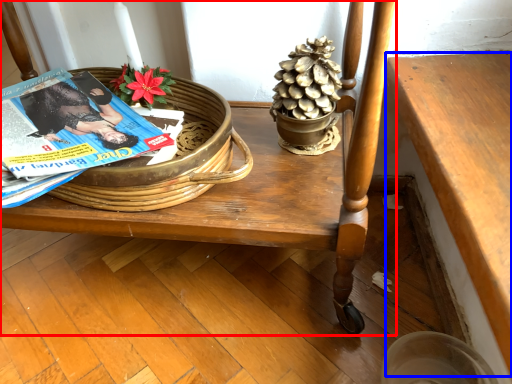
Question: Which of the following is the closest to the observer, furniture (highlighted by a red box) or table (highlighted by a blue box)?

Choices:
 (A) furniture
 (B) table

Answer: (B)